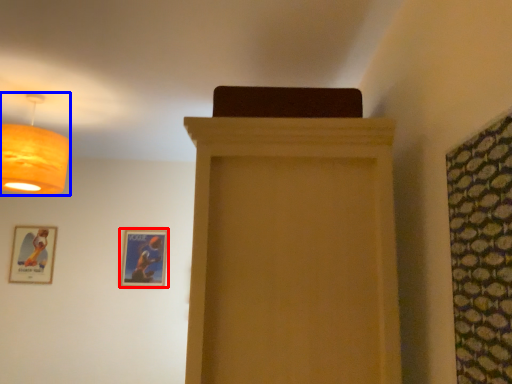
Question: Which of the following is the farthest to the observer, picture frame (highlighted by a red box) or lamp (highlighted by a blue box)?

Choices:
 (A) picture frame
 (B) lamp

Answer: (A)